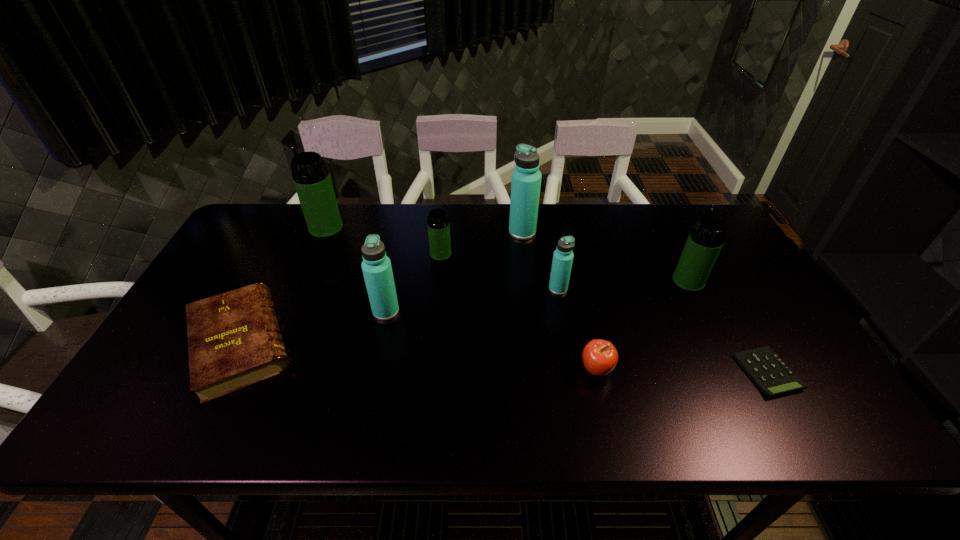
Identify the location of empty space that is in between the calculator and the fifth thermos bottle from left to right. (662, 330).

I want to click on vacant space in between the smallest aqua thermos bottle and the shortest object, so click(x=662, y=330).

You are a GUI agent. You are given a task and a screenshot of the screen. Output one action in this format:
    pyautogui.click(x=<x>, y=<y>)
    Task: Click on the free spot between the second aqua thermos bottle from right to left and the farthest green thermos bottle
    Image resolution: width=960 pixels, height=540 pixels.
    Given the screenshot: What is the action you would take?
    pyautogui.click(x=424, y=230)

Where is `free space that is in between the second farthest aqua thermos bottle and the seventh object from right to left`? Image resolution: width=960 pixels, height=540 pixels. free space that is in between the second farthest aqua thermos bottle and the seventh object from right to left is located at coordinates (472, 300).

Find the location of a particular element. The height and width of the screenshot is (540, 960). free space between the smallest aqua thermos bottle and the hardback book is located at coordinates (399, 316).

Find the location of a particular element. This screenshot has width=960, height=540. free space between the fifth thermos bottle from right to left and the shortest object is located at coordinates (577, 342).

Where is `empty space between the apple and the leftmost thermos bottle`? empty space between the apple and the leftmost thermos bottle is located at coordinates (461, 299).

Where is `object that can be found as the seventh closest to the leftmost green thermos bottle`? The image size is (960, 540). object that can be found as the seventh closest to the leftmost green thermos bottle is located at coordinates (707, 237).

Identify which object is the second nearest to the pink apple. Please provide its 2D coordinates. Your answer should be formatted as a tuple, i.e. [(x, y)], where the tuple contains the x and y coordinates of a point satisfying the conditions above.

[(767, 370)]

Identify which thermos bottle is the third nearest to the hardback book. Please provide its 2D coordinates. Your answer should be formatted as a tuple, i.e. [(x, y)], where the tuple contains the x and y coordinates of a point satisfying the conditions above.

[(438, 225)]